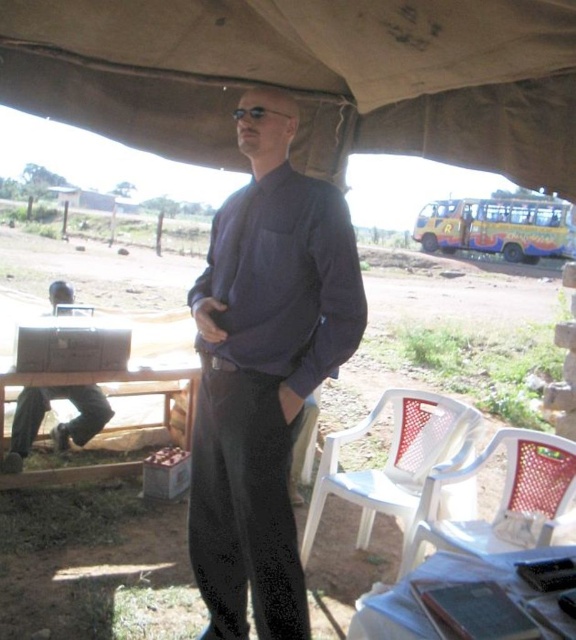
Question: Which of the following is the closest to the observer?

Choices:
 (A) (456, 545)
 (B) (380, 49)
 (C) (426, 412)
 (D) (397, 620)

Answer: (D)

Question: Is white plastic chair at lower center thinner than metallic gray briefcase at left?

Choices:
 (A) yes
 (B) no

Answer: (B)

Question: Is white plastic chair at lower center in front of metallic gray briefcase at left?

Choices:
 (A) yes
 (B) no

Answer: (A)

Question: Among these points, which one is farthest from the camera?

Choices:
 (A) (358, 636)
 (B) (58, 445)

Answer: (B)

Question: Which object appears closest to the camera in this image?

Choices:
 (A) white plastic chair at lower right
 (B) white plastic picnic table at lower right
 (C) dark blue shirt at center
 (D) metallic gray briefcase at left

Answer: (B)

Question: From the image, what is the correct spatial relationship of dark blue shirt at center in relation to metallic gray briefcase at left?

Choices:
 (A) below
 (B) above

Answer: (B)